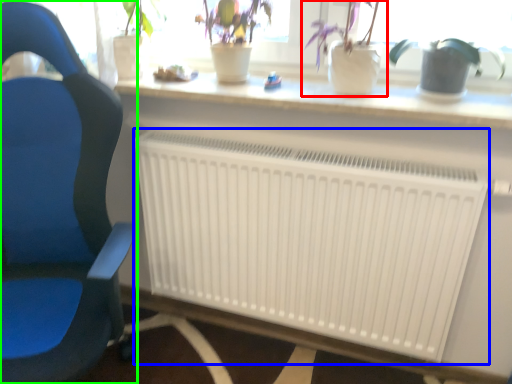
Question: Estimate the real-world distances between objects in this image. Which object is closer to houseplant (highlighted by a red box), radiator (highlighted by a blue box) or chair (highlighted by a green box)?

Choices:
 (A) radiator
 (B) chair

Answer: (A)